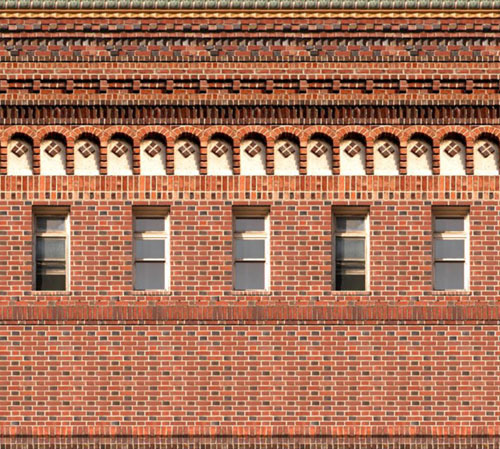
Image resolution: width=500 pixels, height=449 pixels. I want to click on brick wall, so click(198, 362).